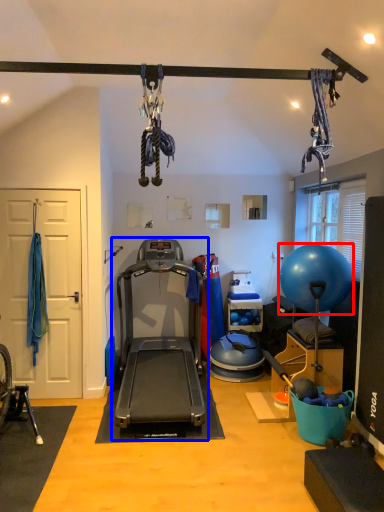
Question: Which object appears farthest to the camera in this image, ball (highlighted by a red box) or treadmill (highlighted by a blue box)?

Choices:
 (A) ball
 (B) treadmill

Answer: (A)